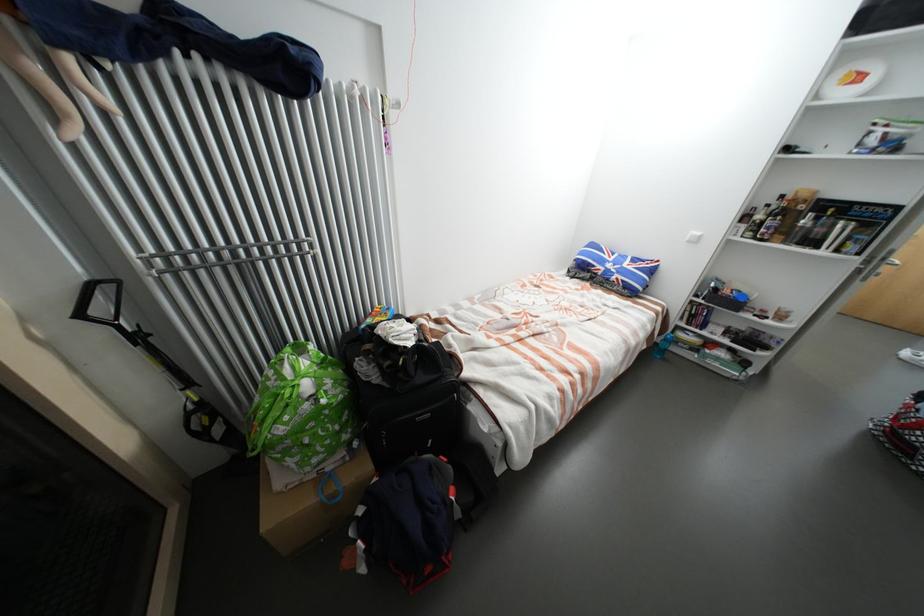
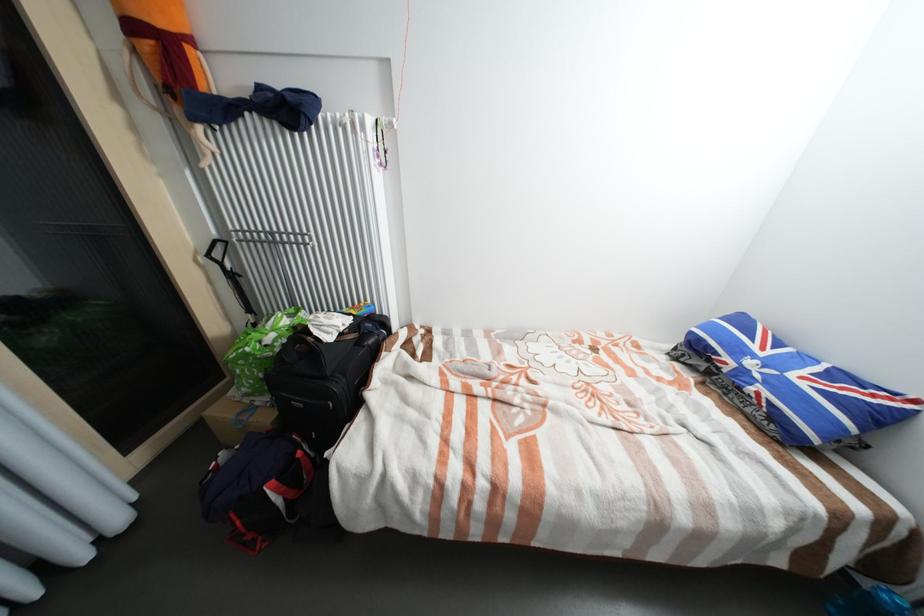
Where in the second image is the point corresponding to point 617,261 from the first image?

(769, 354)